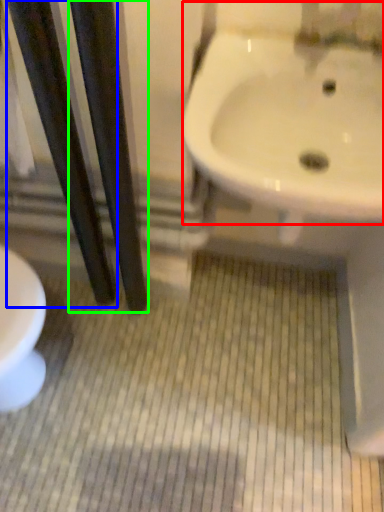
Question: Which object is positioned farthest from sink (highlighted by a red box)? Select from pole (highlighted by a blue box) and pole (highlighted by a green box).

Choices:
 (A) pole
 (B) pole

Answer: (A)